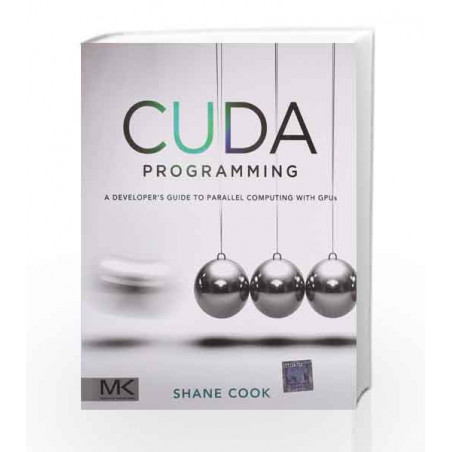
This screenshot has height=452, width=452. Identify the location of box. (120, 231).